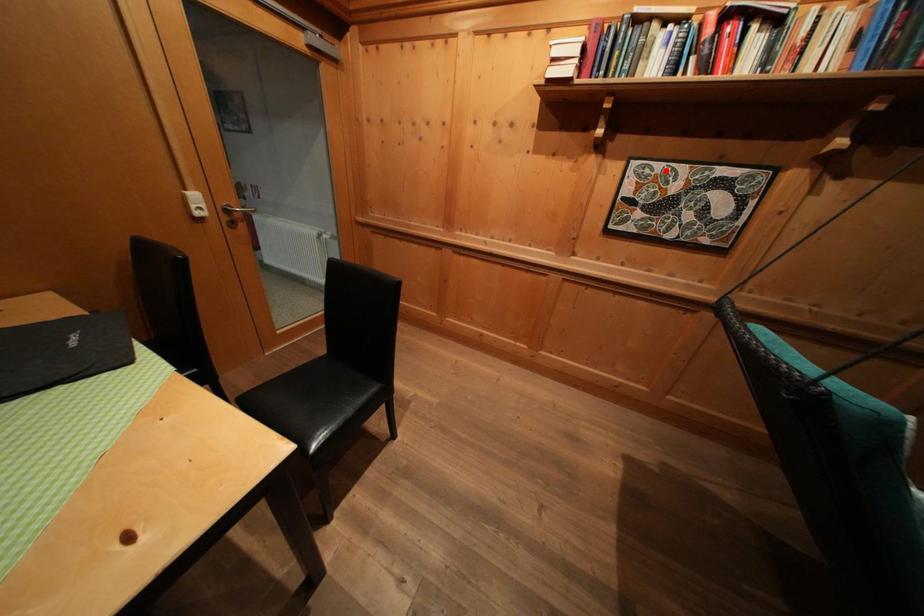
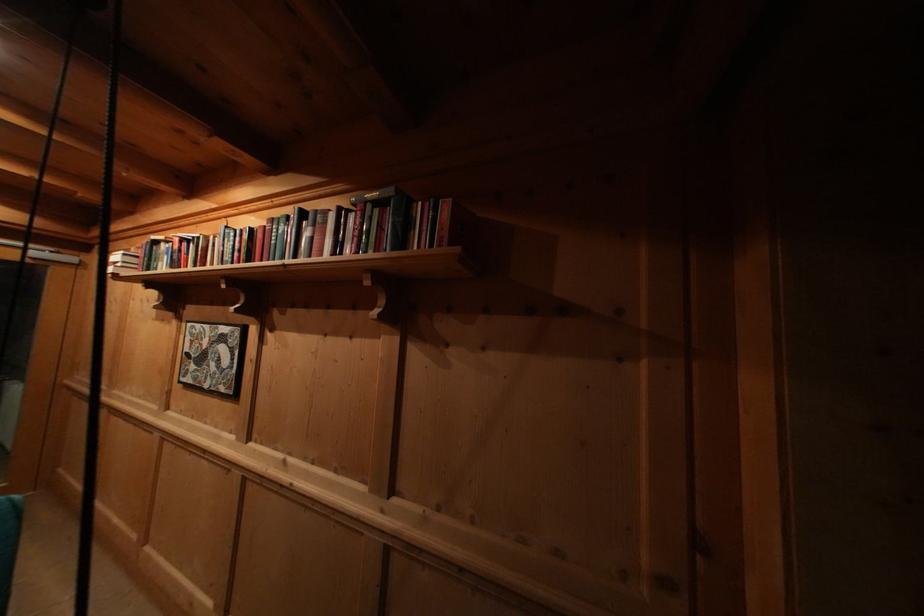
The point at the highlighted location is marked in the first image. Where is the corresponding point in the second image?

(204, 331)